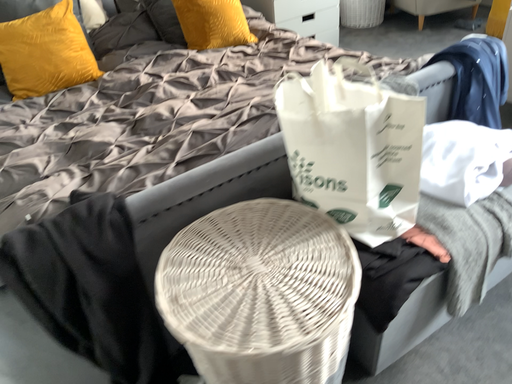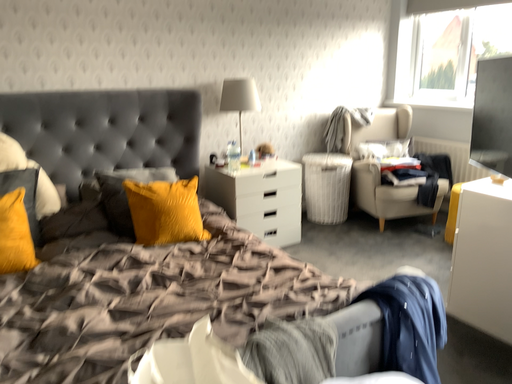
Question: Which way did the camera rotate in the video?

Choices:
 (A) rotated upward
 (B) rotated downward

Answer: (A)